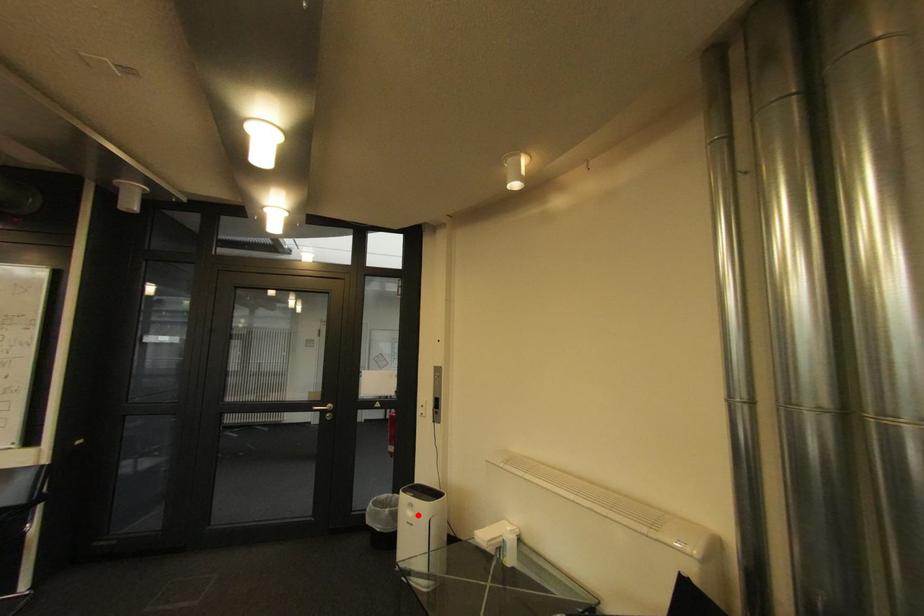
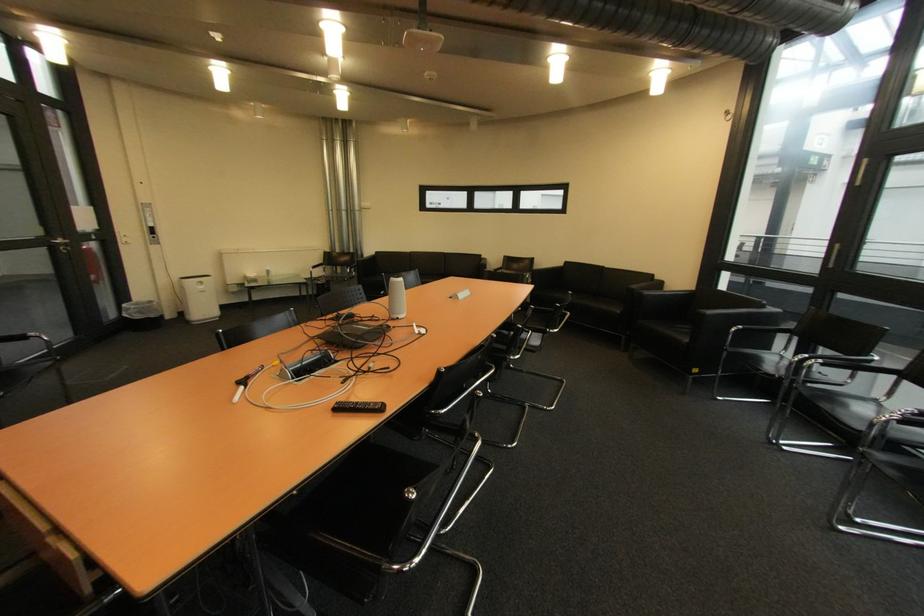
Question: A red point is marked in image1. In image2, is the corresponding 3D point closer to the camera or farther? Reply with the corresponding letter.

Choices:
 (A) The corresponding 3D point is closer.
 (B) The corresponding 3D point is farther.

Answer: (A)